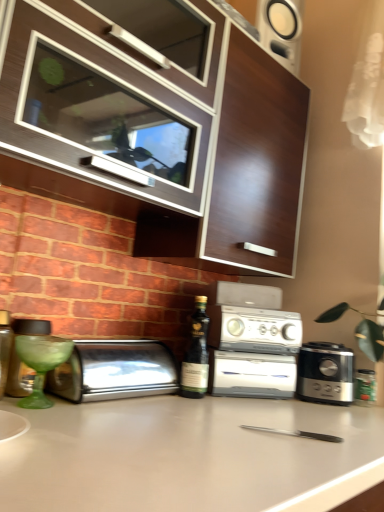
Question: Does white plastic toaster oven at center appear on the right side of dark green glass bottle at center?

Choices:
 (A) no
 (B) yes

Answer: (B)

Question: From the image's perspective, does white plastic toaster oven at center appear higher than dark green glass bottle at center?

Choices:
 (A) yes
 (B) no

Answer: (B)

Question: Considering the relative sizes of white plastic toaster oven at center and dark green glass bottle at center in the image provided, is white plastic toaster oven at center bigger than dark green glass bottle at center?

Choices:
 (A) yes
 (B) no

Answer: (A)

Question: Can you confirm if white plastic toaster oven at center is smaller than dark green glass bottle at center?

Choices:
 (A) no
 (B) yes

Answer: (A)

Question: Could you tell me if white plastic toaster oven at center is facing dark green glass bottle at center?

Choices:
 (A) yes
 (B) no

Answer: (B)

Question: Is white plastic toaster oven at center positioned beyond the bounds of dark green glass bottle at center?

Choices:
 (A) yes
 (B) no

Answer: (A)

Question: From the image's perspective, is matte brown bottle at left, marked as the first bottle in a left-to-right arrangement, beneath green glass jar at right, which is counted as the 2th bottle, starting from the top?

Choices:
 (A) no
 (B) yes

Answer: (A)

Question: Is matte brown bottle at left, the first bottle positioned from the front, to the right of green glass jar at right, the second bottle in the front-to-back sequence, from the viewer's perspective?

Choices:
 (A) no
 (B) yes

Answer: (A)

Question: Is matte brown bottle at left, the first bottle positioned from the front, closer to camera compared to green glass jar at right, which ranks as the first bottle in bottom-to-top order?

Choices:
 (A) yes
 (B) no

Answer: (A)

Question: From a real-world perspective, is matte brown bottle at left, the first bottle positioned from the front, physically below green glass jar at right, which appears as the 1th bottle when viewed from the back?

Choices:
 (A) no
 (B) yes

Answer: (A)

Question: Is matte brown bottle at left, the second bottle from the back, bigger than green glass jar at right, the second bottle in the front-to-back sequence?

Choices:
 (A) no
 (B) yes

Answer: (B)

Question: Does matte brown bottle at left, which ranks as the 2th bottle in right-to-left order, appear on the left side of green glass jar at right, which is counted as the 2th bottle, starting from the top?

Choices:
 (A) no
 (B) yes

Answer: (B)

Question: Is white plastic toaster oven at center in front of matte brown bottle at left, the first bottle positioned from the front?

Choices:
 (A) yes
 (B) no

Answer: (B)